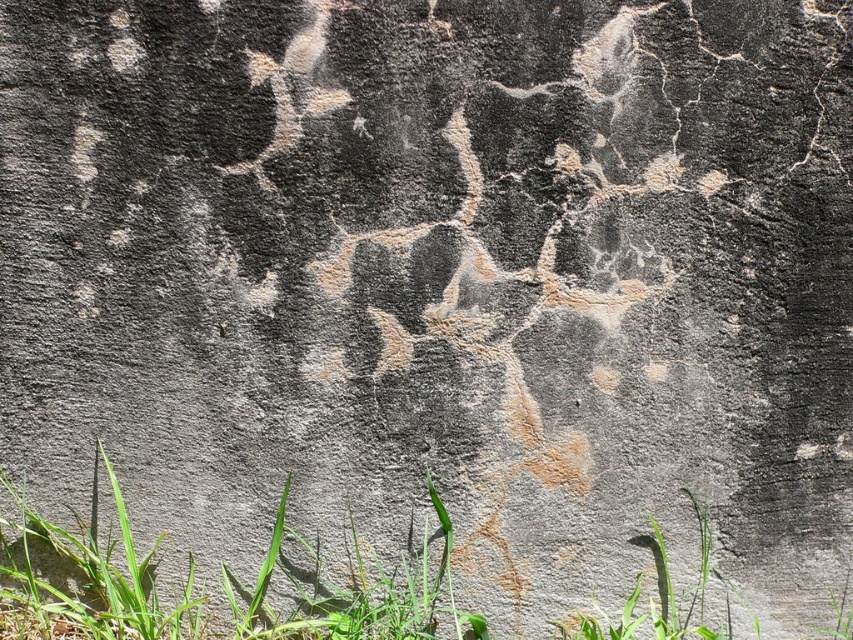
You are standing in front of the rock and notice two patches of greenery. One is the green grass at lower left and the other is the green leafy grass at bottom. Which one is positioned more to the left side?

The green grass at lower left is positioned more to the left side than the green leafy grass at bottom.

You are standing 3 meters away from the rock. A point on the rock surface at coordinate point is labeled as point (303, 598). Can you reach that point with your hand?

The distance of point (303, 598) from viewer is 2.76 meters, so you are standing 3 meters away from the rock. Since the point is closer than your standing position, you can reach it with your hand.

You are standing next to the rock and want to place a small garden gnome between the green grass at lower left and the green leafy grass at bottom. Can you fit the gnome if it requires at least 18 inches of space between them?

The distance between the green grass at lower left and the green leafy grass at bottom is 18.53 inches, so yes, the gnome can be placed between them as the required 18 inches is met.